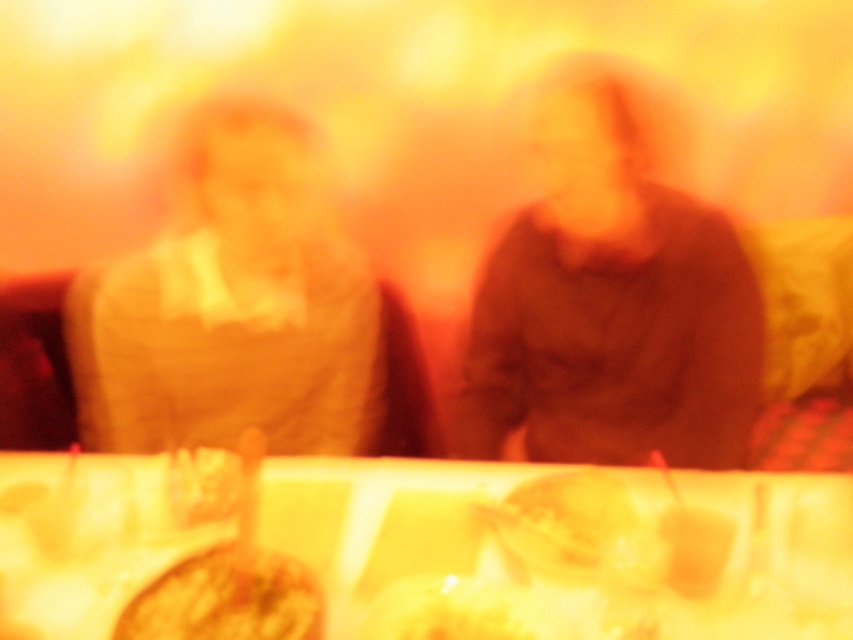
Question: Is matte beige sweater at left positioned in front of yellow matte plate at center?

Choices:
 (A) yes
 (B) no

Answer: (B)

Question: Does matte brown sweater at center have a greater width compared to matte beige sweater at left?

Choices:
 (A) yes
 (B) no

Answer: (B)

Question: Which object is farther from the camera taking this photo?

Choices:
 (A) matte beige sweater at left
 (B) yellow matte plate at center

Answer: (A)

Question: Which object is positioned closest to the matte brown sweater at center?

Choices:
 (A) smooth yellow cake at center
 (B) smooth yellow cake at lower center
 (C) wooden table at center

Answer: (A)

Question: Which point is farther to the camera?

Choices:
 (A) wooden table at center
 (B) smooth yellow cake at center
 (C) yellow matte plate at center
 (D) matte beige sweater at left

Answer: (D)

Question: Does matte brown sweater at center appear under matte beige sweater at left?

Choices:
 (A) yes
 (B) no

Answer: (B)